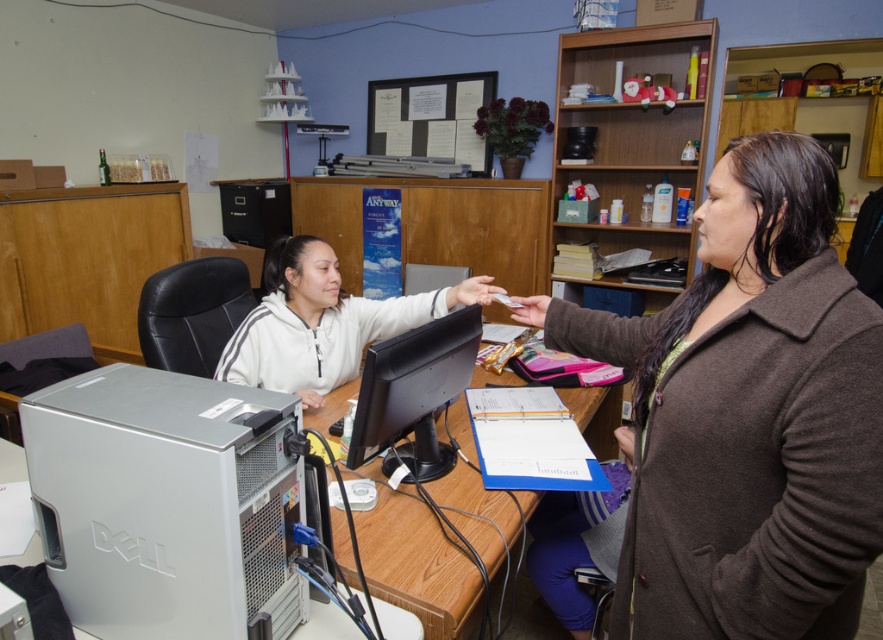
You are organizing items on the desk and need to place the silver metallic computer tower at lower left next to the white fleece jacket at center. Considering their widths, which object should you move to make space?

The silver metallic computer tower at lower left has a lesser width compared to the white fleece jacket at center, so you should move the white fleece jacket at center to make space since it takes up more horizontal space.

You are standing at the entrance of the office and want to locate the silver metallic computer tower at lower left. What are the coordinates of its position?

The silver metallic computer tower at lower left is located at coordinates point (165,502).

You are a delivery person who needs to place a 20 inch long package on the desk without moving any existing items. The silver metallic computer tower at lower left is in the way. Can you still place the package on the desk?

The silver metallic computer tower at lower left is 31.30 inches away from the camera, so there is enough space to place the 20 inch long package on the desk without moving any items.